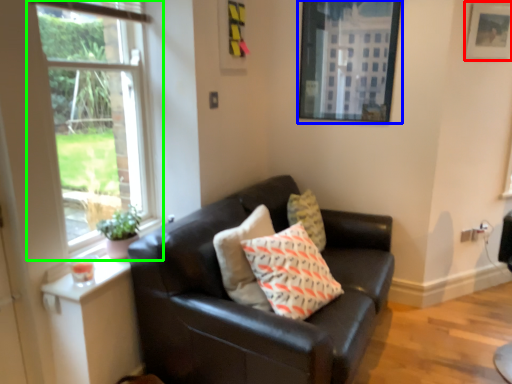
Question: Which object is positioned farthest from picture frame (highlighted by a red box)? Select from picture frame (highlighted by a blue box) and window (highlighted by a green box).

Choices:
 (A) picture frame
 (B) window

Answer: (B)